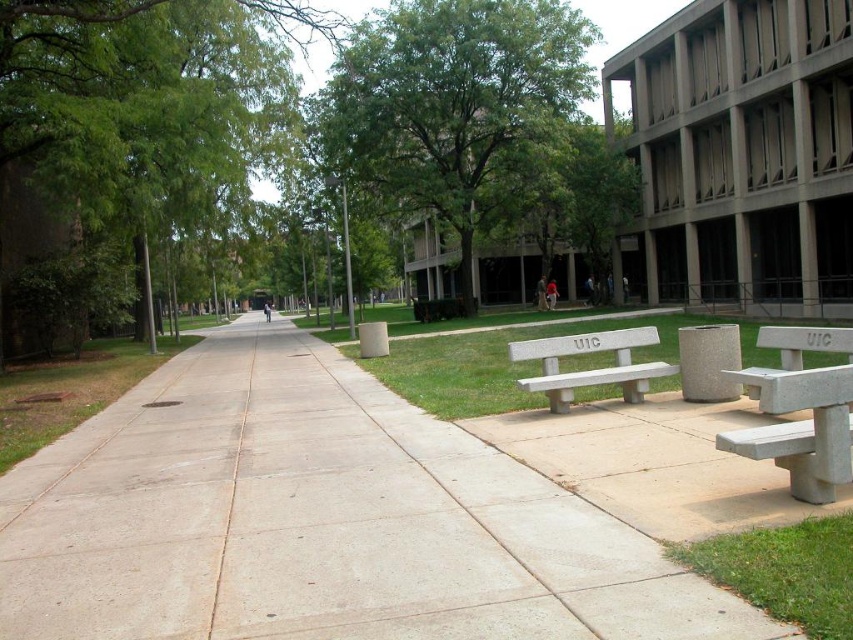
Question: Does green leafy tree at left have a lesser width compared to green leafy tree at center?

Choices:
 (A) yes
 (B) no

Answer: (A)

Question: Which point appears farthest from the camera in this image?

Choices:
 (A) (846, 572)
 (B) (13, 625)
 (C) (556, 401)

Answer: (C)

Question: Estimate the real-world distances between objects in this image. Which object is closer to the green leafy tree at left?

Choices:
 (A) white concrete bench at center
 (B) gray concrete bench at right

Answer: (A)

Question: Which of the following is the closest to the observer?

Choices:
 (A) green leafy tree at left
 (B) white concrete bench at center

Answer: (B)

Question: Is green leafy tree at left positioned in front of green grass at lower right?

Choices:
 (A) yes
 (B) no

Answer: (B)

Question: Is green leafy tree at center bigger than white concrete bench at center?

Choices:
 (A) no
 (B) yes

Answer: (B)